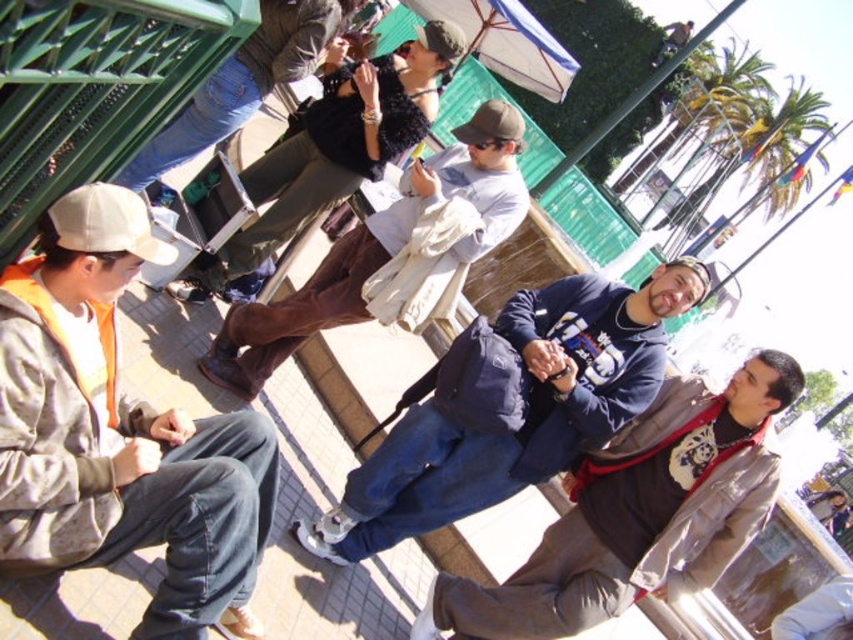
Who is positioned more to the left, dark blue sweatshirt at center or jeans at upper left?

jeans at upper left is more to the left.

Between dark blue sweatshirt at center and jeans at upper left, which one has more height?

jeans at upper left is taller.

This screenshot has height=640, width=853. What do you see at coordinates (526, 412) in the screenshot? I see `dark blue sweatshirt at center` at bounding box center [526, 412].

At what (x,y) coordinates should I click in order to perform the action: click on dark blue sweatshirt at center. Please return your answer as a coordinate pair (x, y). The height and width of the screenshot is (640, 853). Looking at the image, I should click on (526, 412).

Between dark blue jacket at center and dark brown leather pants at center, which one appears on the left side from the viewer's perspective?

From the viewer's perspective, dark brown leather pants at center appears more on the left side.

Can you confirm if dark blue jacket at center is positioned below dark brown leather pants at center?

Indeed, dark blue jacket at center is positioned under dark brown leather pants at center.

Where is `dark blue jacket at center`? dark blue jacket at center is located at coordinates (639, 513).

Is dark blue sweatshirt at center thinner than dark brown leather jacket at upper center?

No, dark blue sweatshirt at center is not thinner than dark brown leather jacket at upper center.

Can you confirm if dark blue sweatshirt at center is taller than dark brown leather jacket at upper center?

No, dark blue sweatshirt at center is not taller than dark brown leather jacket at upper center.

Between point (668, 273) and point (404, 68), which one is positioned behind?

Positioned behind is point (404, 68).

Locate an element on the screen. Image resolution: width=853 pixels, height=640 pixels. dark blue sweatshirt at center is located at coordinates [x=526, y=412].